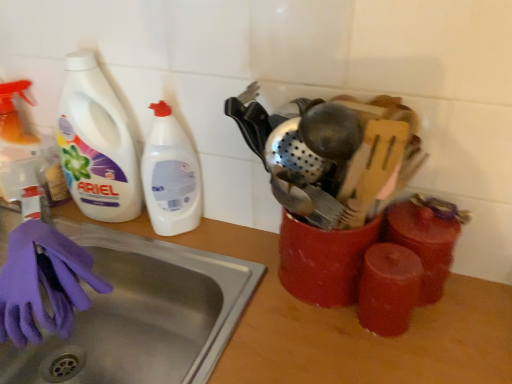
Where is `vacant area that is in front of white plastic bottle at left`? vacant area that is in front of white plastic bottle at left is located at coordinates tap(108, 241).